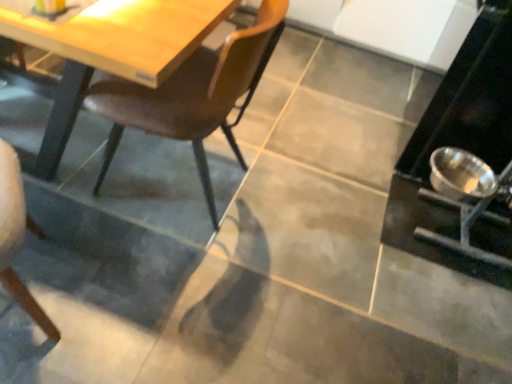
Question: Considering the positions of silver metallic bowl at lower right and brown leather chair at center in the image, is silver metallic bowl at lower right taller or shorter than brown leather chair at center?

Choices:
 (A) short
 (B) tall

Answer: (B)

Question: Considering the positions of point (503, 205) and point (243, 112), is point (503, 205) closer or farther from the camera than point (243, 112)?

Choices:
 (A) closer
 (B) farther

Answer: (A)

Question: Choose the correct answer: Is silver metallic bowl at lower right inside brown leather chair at center or outside it?

Choices:
 (A) inside
 (B) outside

Answer: (B)

Question: From the image's perspective, is brown leather chair at center above or below silver metallic bowl at lower right?

Choices:
 (A) above
 (B) below

Answer: (B)

Question: Is brown leather chair at center inside or outside of silver metallic bowl at lower right?

Choices:
 (A) outside
 (B) inside

Answer: (A)

Question: Looking at their shapes, would you say brown leather chair at center is wider or thinner than silver metallic bowl at lower right?

Choices:
 (A) wide
 (B) thin

Answer: (B)

Question: Is brown leather chair at center to the left or to the right of silver metallic bowl at lower right in the image?

Choices:
 (A) right
 (B) left

Answer: (B)